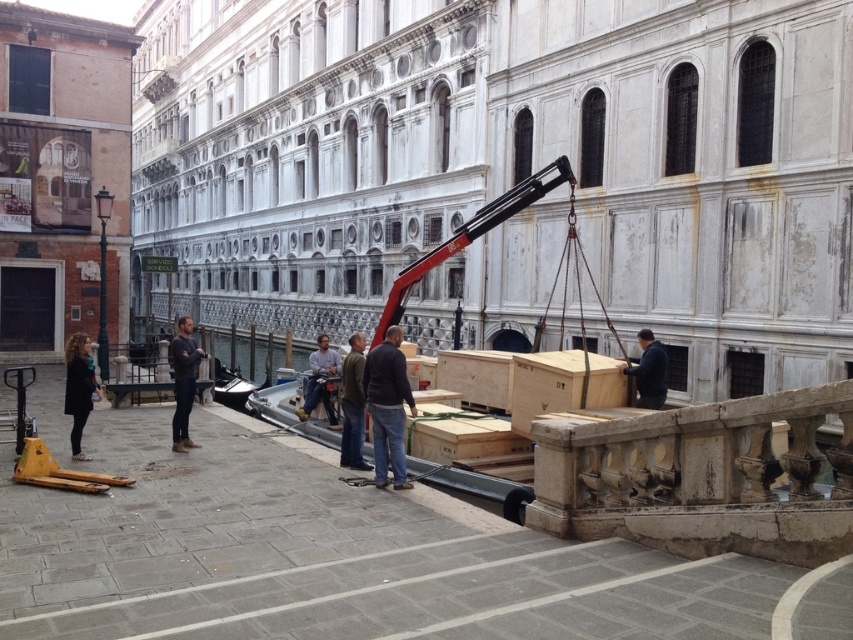
Question: Can you confirm if dark blue sweater at center is smaller than dark brown leather coat at lower left?

Choices:
 (A) yes
 (B) no

Answer: (A)

Question: Is dark gray sweater at center thinner than dark brown leather coat at lower left?

Choices:
 (A) yes
 (B) no

Answer: (B)

Question: Which object is closer to the camera taking this photo?

Choices:
 (A) light blue jeans at center
 (B) dark blue fabric at center
 (C) brown leather jacket at center

Answer: (C)

Question: Considering the real-world distances, which object is closest to the brown leather jacket at center?

Choices:
 (A) dark blue sweater at center
 (B) dark gray sweater at center
 (C) dark blue fabric at center
 (D) dark brown leather coat at lower left

Answer: (A)

Question: Can you confirm if brown leather jacket at center is wider than light blue jeans at center?

Choices:
 (A) no
 (B) yes

Answer: (A)

Question: Which object appears farthest from the camera in this image?

Choices:
 (A) dark blue fabric at center
 (B) dark gray sweater at center
 (C) brown leather jacket at center
 (D) dark blue sweater at center

Answer: (B)